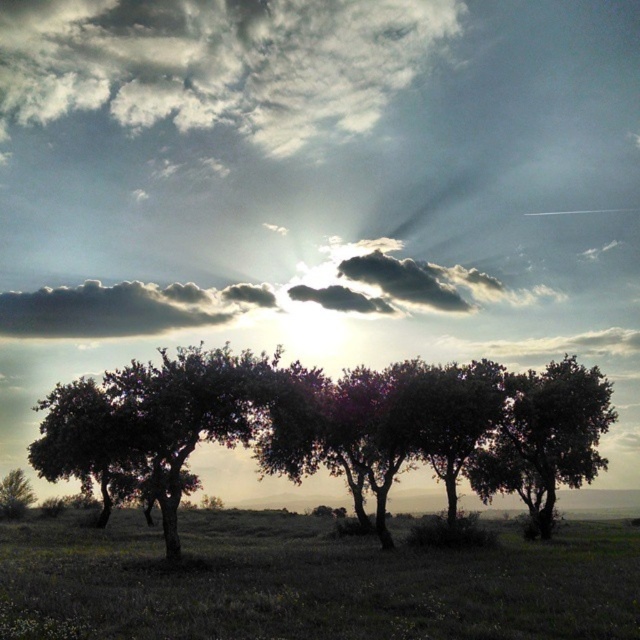
Based on the photo, you are standing at the point labeled as point (310, 582) in the image. What is the name of the object you are standing on?

The point (310, 582) corresponds to green grassy at lower center, so you are standing on the green grassy area at lower center.

You are a photographer trying to capture the entire scene in one shot. Given that your camera frame can only accommodate objects up to the size of the green leafy tree at left, will the green grassy at lower center fit within your frame?

The green grassy at lower center is larger in size than the green leafy tree at left, so it will not fit within the camera frame designed for the tree size.